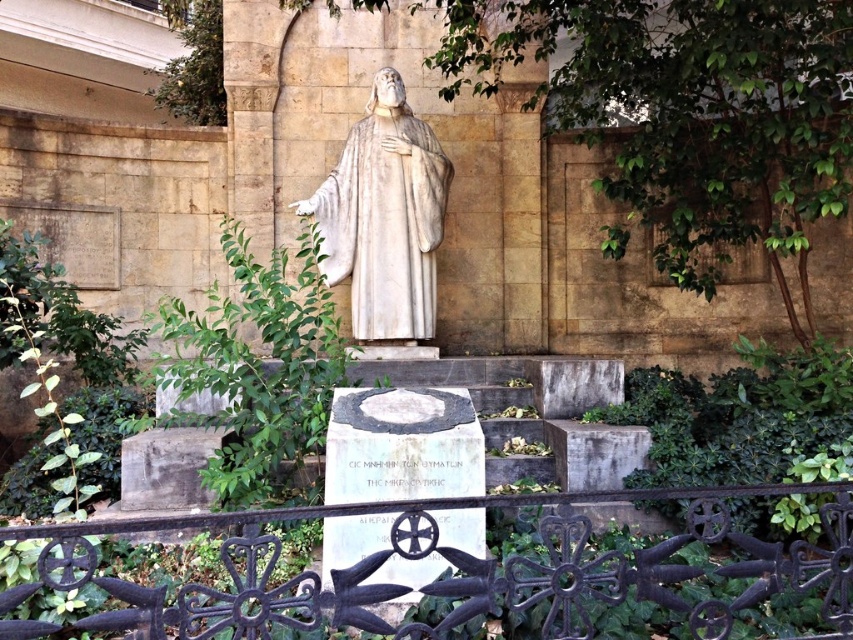
In the scene shown: You are a visitor approaching the white marble statue at center from the front entrance. There is a black wrought iron fence at lower center in your path. Can you walk directly to the statue without going around the fence?

The black wrought iron fence at lower center is bigger than the white marble statue at center, so the fence is larger in size. Since the fence is in your path, you would need to go around it to reach the statue.

You are standing at the point marked as point (459, 570) in the scene. What object is located exactly at that coordinate?

The black wrought iron fence at lower center is located exactly at point (459, 570).

Looking at this image, you are a painter standing at the base of the black wrought iron fence at lower center, wanting to paint the white marble statue at center. If your longest brush is 9 feet, can you reach the statue with your brush?

The black wrought iron fence at lower center is 10.05 feet away from the white marble statue at center. Since your brush is only 9 feet long, you cannot reach the statue from your current position.